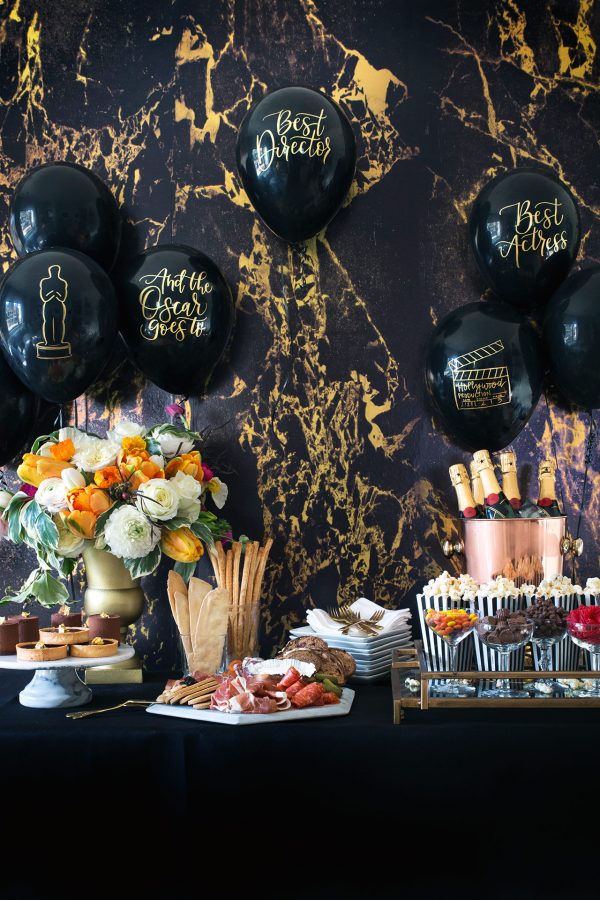
I want to click on flower vase, so click(111, 597).